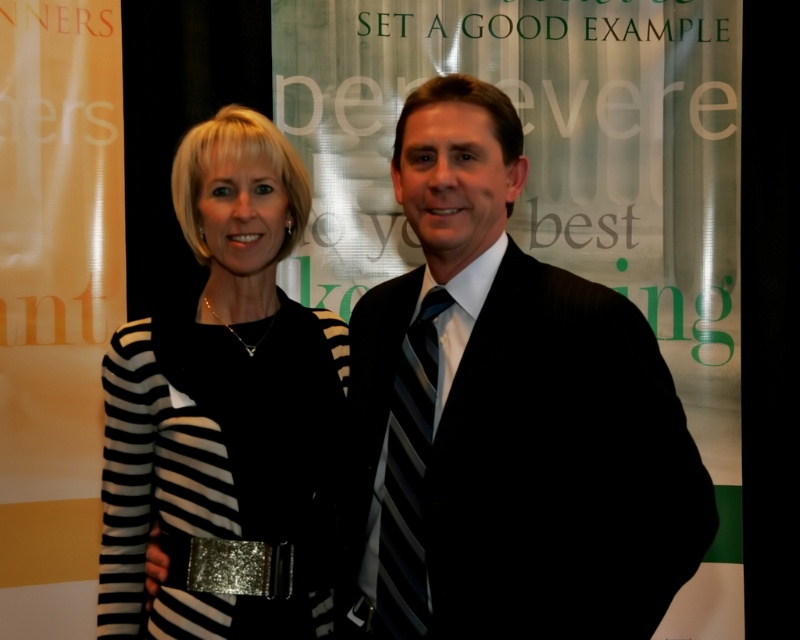
Question: Does black striped suit at center appear under black striped dress at center?

Choices:
 (A) no
 (B) yes

Answer: (A)

Question: Does black striped suit at center have a lesser width compared to black striped tie at center?

Choices:
 (A) yes
 (B) no

Answer: (B)

Question: Among these points, which one is farthest from the camera?

Choices:
 (A) (630, 508)
 (B) (394, 429)

Answer: (B)

Question: Considering the real-world distances, which object is closest to the black striped dress at center?

Choices:
 (A) black striped tie at center
 (B) black striped suit at center

Answer: (B)

Question: Can you confirm if black striped suit at center is thinner than black striped dress at center?

Choices:
 (A) no
 (B) yes

Answer: (A)

Question: Among these objects, which one is farthest from the camera?

Choices:
 (A) black striped dress at center
 (B) black striped suit at center

Answer: (A)